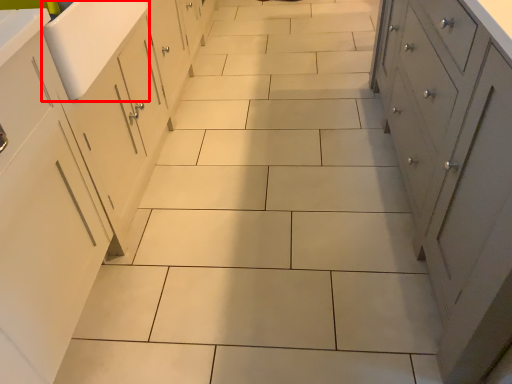
Question: From the image's perspective, considering the relative positions of sink (annotated by the red box) and cupboard in the image provided, where is sink (annotated by the red box) located with respect to the staircase?

Choices:
 (A) above
 (B) below

Answer: (A)